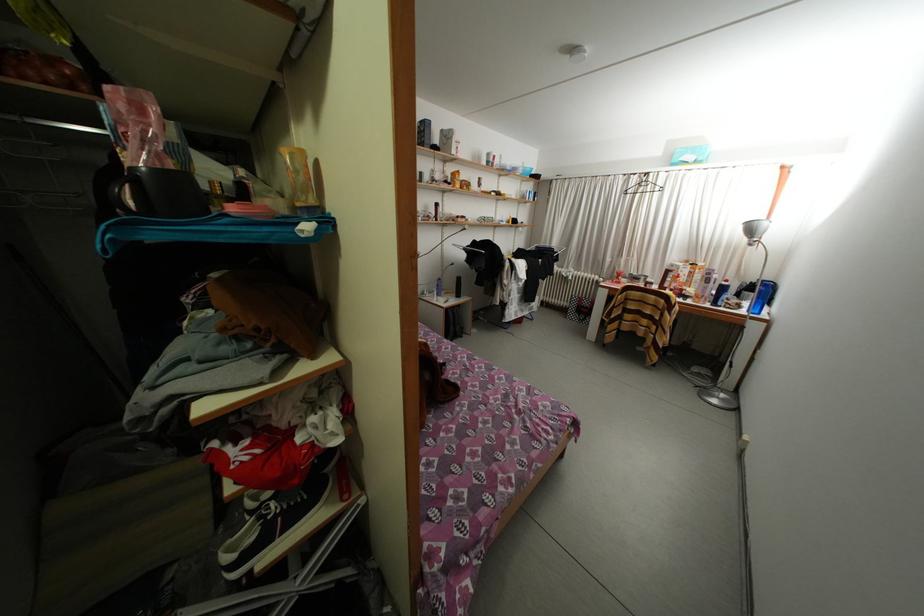
I want to click on clothes hanger, so click(642, 185).